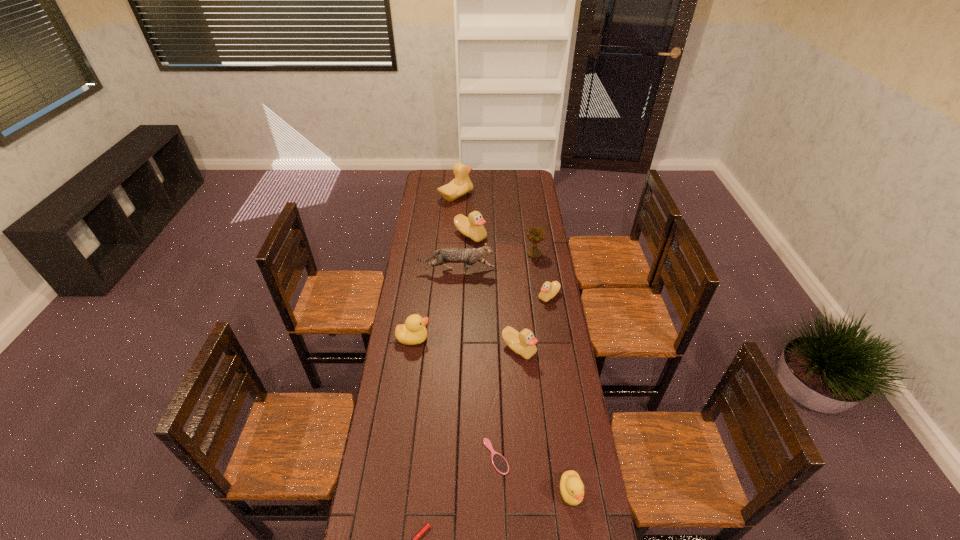
Locate an element on the screen. the farthest duck is located at coordinates (461, 184).

Image resolution: width=960 pixels, height=540 pixels. What are the coordinates of `the tallest duck` in the screenshot? It's located at (461, 184).

The width and height of the screenshot is (960, 540). I want to click on the fourth farthest object, so click(x=445, y=255).

Locate an element on the screen. The height and width of the screenshot is (540, 960). the fifth nearest duck is located at coordinates (472, 227).

Find the location of a particular element. Image resolution: width=960 pixels, height=540 pixels. the fifth shortest duck is located at coordinates (472, 227).

Locate an element on the screen. The width and height of the screenshot is (960, 540). the third farthest object is located at coordinates (535, 234).

The image size is (960, 540). In order to click on chalice in this screenshot , I will do `click(535, 234)`.

Locate an element on the screen. This screenshot has width=960, height=540. the third duck from right to left is located at coordinates pyautogui.click(x=523, y=343).

The height and width of the screenshot is (540, 960). Find the location of `the nearest beige duck`. the nearest beige duck is located at coordinates (523, 343).

Where is `the bigger yellow duck`? The height and width of the screenshot is (540, 960). the bigger yellow duck is located at coordinates (413, 332).